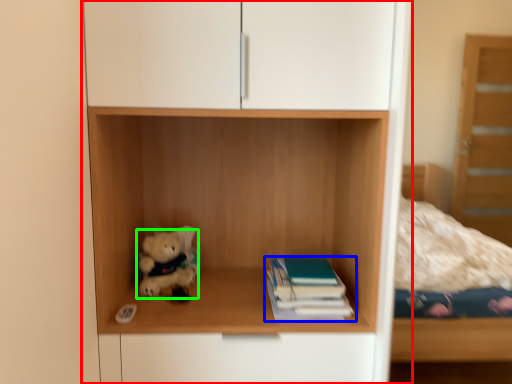
Question: Considering the real-world distances, which object is closest to cupboard (highlighted by a red box)? book (highlighted by a blue box) or teddy bear (highlighted by a green box).

Choices:
 (A) book
 (B) teddy bear

Answer: (A)